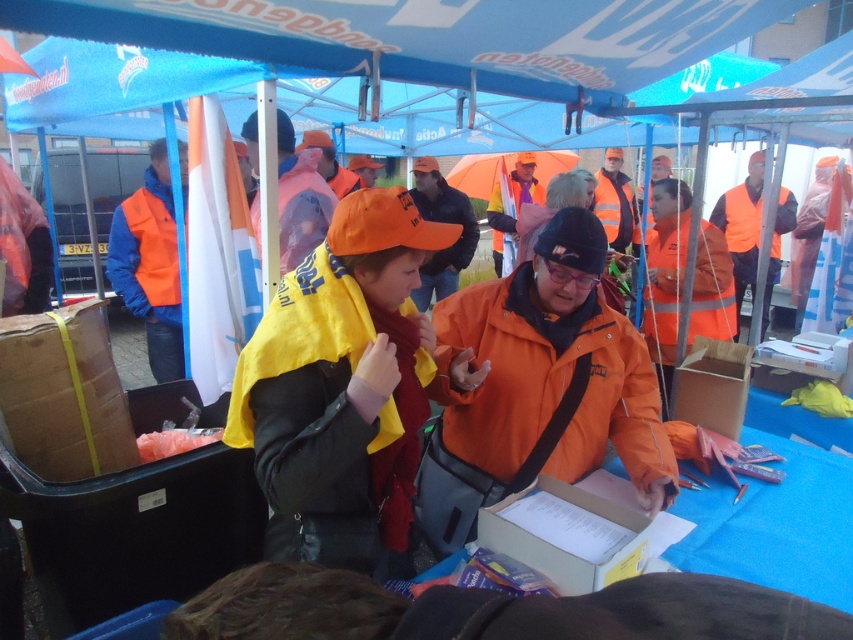
You are standing at the edge of the event area and need to hand a document to the person in the orange matte jacket at center. The reflective orange vest at center is blocking your path. Can you reach the person without moving the vest wearer?

The orange matte jacket at center is 2.74 meters away from the reflective orange vest at center. Since the distance between them is over 2 meters, you can likely reach the person by going around the vest wearer without needing to move them.

You are standing at the point labeled as point (613, 506). You want to hand a document to the person at the other end of the canopy. Is the distance between you and them sufficient to safely pass the document without needing to move closer?

The distance between you and the person at the other end of the canopy is 1.63 meters, which is sufficient to safely pass the document without needing to move closer.